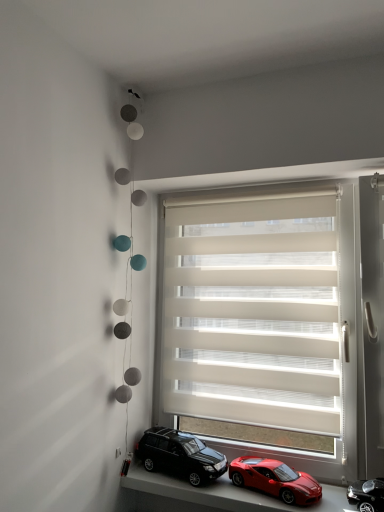
Where is `blank area beneath shiny red car at lower center, the second car in the right-to-left sequence (from a real-world perspective)`? blank area beneath shiny red car at lower center, the second car in the right-to-left sequence (from a real-world perspective) is located at coordinates (277, 496).